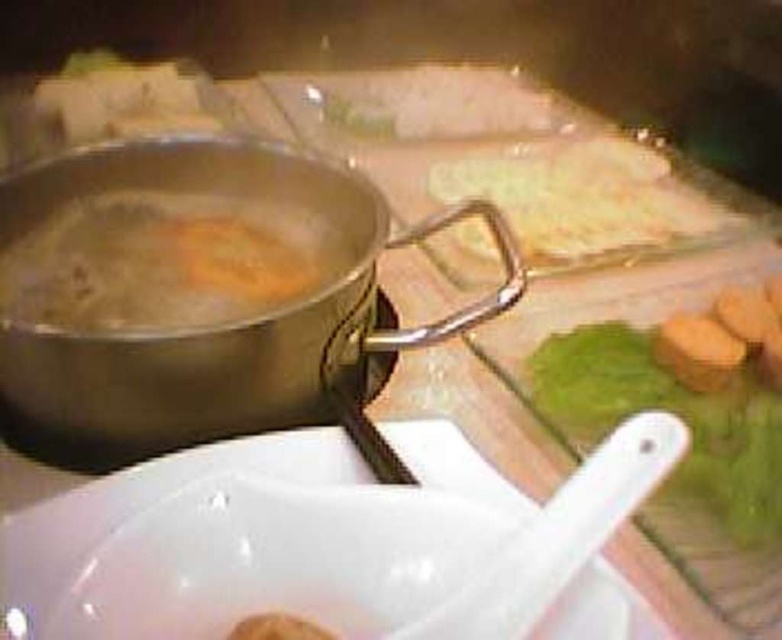
Question: Which object appears closest to the camera in this image?

Choices:
 (A) translucent glass noodles at upper center
 (B) orange soft bread at center

Answer: (B)

Question: Is orange soft bread at center thinner than translucent glass noodles at upper center?

Choices:
 (A) no
 (B) yes

Answer: (B)

Question: Does orange soft bread at center appear under translucent glass noodles at upper center?

Choices:
 (A) no
 (B) yes

Answer: (B)

Question: Among these points, which one is farthest from the camera?

Choices:
 (A) (99, 205)
 (B) (537, 195)

Answer: (B)

Question: Observing the image, what is the correct spatial positioning of orange soft bread at center in reference to translucent glass noodles at upper center?

Choices:
 (A) above
 (B) below

Answer: (B)